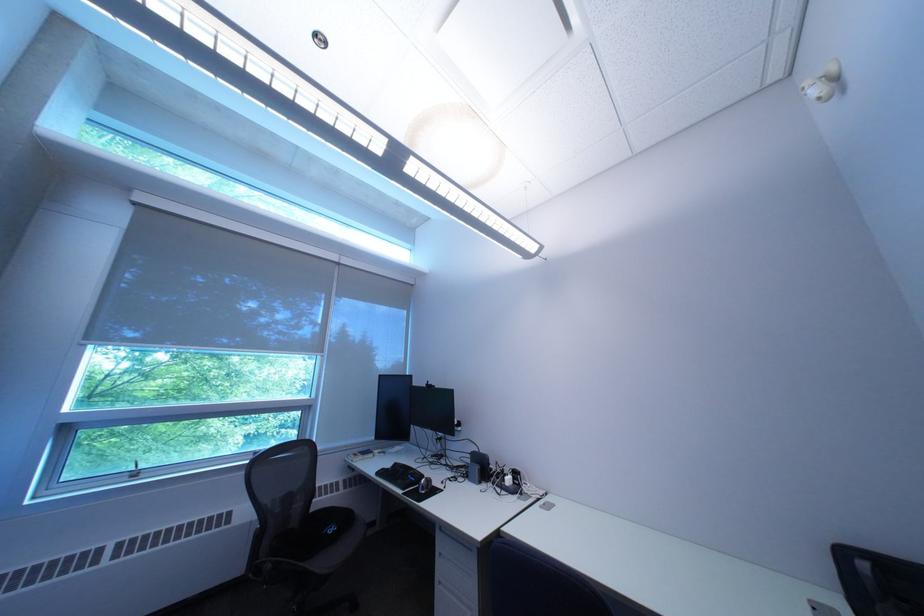
What do you see at coordinates (822, 83) in the screenshot?
I see `a window crank handle` at bounding box center [822, 83].